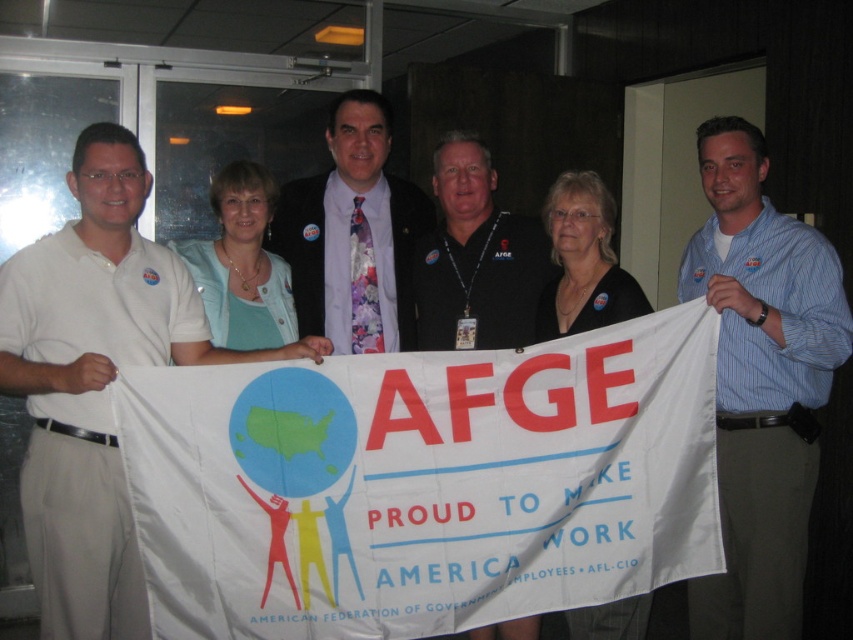
You are a photographer standing 2 meters away from the group. You want to capture a closeup shot of both the white shirt at left and the blue striped shirt at center in the same frame. Can you do this without moving your position? Explain.

The white shirt at left is 1.38 meters from the blue striped shirt at center. Since the distance between them is less than the 2 meters you are away from the group, it is possible to capture both in the same frame without moving.